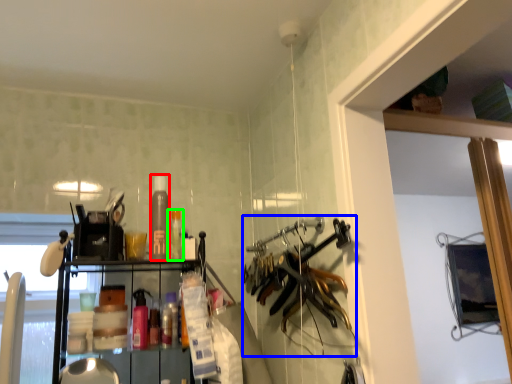
Question: Which object is the farthest from bottle (highlighted by a red box)? Choose among these: hanger (highlighted by a blue box) or bottle (highlighted by a green box).

Choices:
 (A) hanger
 (B) bottle

Answer: (A)